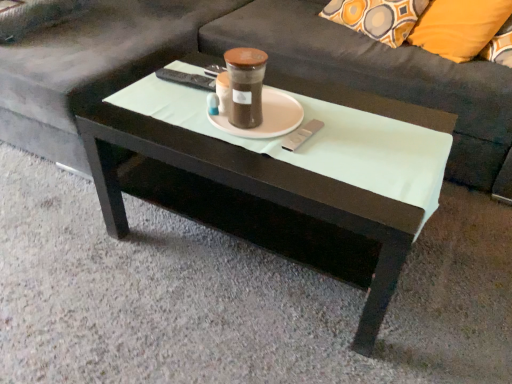
What do you see at coordinates (266, 117) in the screenshot? I see `white matte saucer at center` at bounding box center [266, 117].

Where is `brown matte glass jar at center`? brown matte glass jar at center is located at coordinates (245, 86).

The width and height of the screenshot is (512, 384). Describe the element at coordinates (242, 45) in the screenshot. I see `dark gray fabric couch at center` at that location.

Identify the location of white matte saucer at center. Image resolution: width=512 pixels, height=384 pixels. pyautogui.click(x=266, y=117).

From a real-world perspective, between white glossy coffee table at center and dark gray fabric couch at center, who is vertically lower?

From a 3D spatial view, white glossy coffee table at center is below.

Is point (150, 121) in front of point (453, 89)?

That is True.

Consider the image. Which is more to the right, white glossy coffee table at center or dark gray fabric couch at center?

white glossy coffee table at center.

Are white glossy coffee table at center and brown matte glass jar at center located far from each other?

No, white glossy coffee table at center is not far away from brown matte glass jar at center.

Would you say white glossy coffee table at center is to the left or to the right of brown matte glass jar at center in the picture?

In the image, white glossy coffee table at center appears on the right side of brown matte glass jar at center.

Could you tell me if white glossy coffee table at center is turned towards brown matte glass jar at center?

No, white glossy coffee table at center is not aimed at brown matte glass jar at center.

Is white glossy coffee table at center taller or shorter than brown matte glass jar at center?

Clearly, white glossy coffee table at center is taller compared to brown matte glass jar at center.

Does orange fabric pillow at upper right have a lesser height compared to white glossy coffee table at center?

Yes, orange fabric pillow at upper right is shorter than white glossy coffee table at center.

Considering the relative sizes of orange fabric pillow at upper right and white glossy coffee table at center in the image provided, is orange fabric pillow at upper right bigger than white glossy coffee table at center?

Actually, orange fabric pillow at upper right might be smaller than white glossy coffee table at center.

From a real-world perspective, is orange fabric pillow at upper right beneath white glossy coffee table at center?

No.

Which is closer, [476,15] or [100,158]?

Clearly, point [476,15] is more distant from the camera than point [100,158].

Looking at this image, is orange fabric pillow at upper right not near white matte saucer at center?

They are positioned close to each other.

Does orange fabric pillow at upper right have a smaller size compared to white matte saucer at center?

No.

Is point (416, 38) more distant than point (298, 121)?

Yes.

Image resolution: width=512 pixels, height=384 pixels. What are the coordinates of `saucer that appears above the orange fabric pillow at upper right (from a real-world perspective)` in the screenshot? It's located at (266, 117).

Do you think white matte saucer at center is within dark gray fabric couch at center, or outside of it?

white matte saucer at center lies outside dark gray fabric couch at center.

Who is bigger, white matte saucer at center or dark gray fabric couch at center?

dark gray fabric couch at center is bigger.

The width and height of the screenshot is (512, 384). I want to click on studio couch behind the white matte saucer at center, so click(242, 45).

Considering the relative positions of white matte saucer at center and dark gray fabric couch at center in the image provided, is white matte saucer at center in front of dark gray fabric couch at center?

Yes, it is in front of dark gray fabric couch at center.

Is dark gray fabric couch at center in contact with orange fabric pillow at upper right?

They are not placed beside each other.

Which is behind, dark gray fabric couch at center or orange fabric pillow at upper right?

orange fabric pillow at upper right.

Which of these two, dark gray fabric couch at center or orange fabric pillow at upper right, is wider?

dark gray fabric couch at center.

Find the location of a particular element. studio couch above the orange fabric pillow at upper right (from the image's perspective) is located at coordinates (242, 45).

Does dark gray fabric couch at center contain white matte saucer at center?

No, white matte saucer at center is located outside of dark gray fabric couch at center.

Is white matte saucer at center at the back of dark gray fabric couch at center?

No, dark gray fabric couch at center is not facing away from white matte saucer at center.

Measure the distance between dark gray fabric couch at center and white matte saucer at center.

dark gray fabric couch at center and white matte saucer at center are 28.31 inches apart.

Which of these two, dark gray fabric couch at center or white matte saucer at center, is thinner?

With smaller width is white matte saucer at center.

Identify the location of studio couch located on the left of white glossy coffee table at center. (242, 45).

At what (x,y) coordinates should I click in order to perform the action: click on beverage above the white glossy coffee table at center (from the image's perspective). Please return your answer as a coordinate pair (x, y). This screenshot has height=384, width=512. Looking at the image, I should click on (245, 86).

From the image, which object appears to be nearer to dark gray fabric couch at center, white glossy coffee table at center or brown matte glass jar at center?

white glossy coffee table at center is positioned closer to the anchor dark gray fabric couch at center.

Based on their spatial positions, is brown matte glass jar at center or white glossy coffee table at center further from white matte saucer at center?

Among the two, white glossy coffee table at center is located further to white matte saucer at center.

Based on their spatial positions, is brown matte glass jar at center or white glossy coffee table at center further from orange fabric pillow at upper right?

white glossy coffee table at center.

Estimate the real-world distances between objects in this image. Which object is closer to white glossy coffee table at center, orange fabric pillow at upper right or dark gray fabric couch at center?

dark gray fabric couch at center is closer to white glossy coffee table at center.

Looking at the image, which one is located closer to orange fabric pillow at upper right, white matte saucer at center or brown matte glass jar at center?

white matte saucer at center.

When comparing their distances from orange fabric pillow at upper right, does brown matte glass jar at center or dark gray fabric couch at center seem closer?

dark gray fabric couch at center is positioned closer to the anchor orange fabric pillow at upper right.

Looking at the image, which one is located further to orange fabric pillow at upper right, white glossy coffee table at center or brown matte glass jar at center?

white glossy coffee table at center lies further to orange fabric pillow at upper right than the other object.

From the image, which object appears to be farther from orange fabric pillow at upper right, dark gray fabric couch at center or white glossy coffee table at center?

Based on the image, white glossy coffee table at center appears to be further to orange fabric pillow at upper right.

Locate an element on the screen. beverage between dark gray fabric couch at center and orange fabric pillow at upper right in the horizontal direction is located at coordinates (245, 86).

Identify the location of saucer between brown matte glass jar at center and white glossy coffee table at center from top to bottom. This screenshot has width=512, height=384. (266, 117).

The height and width of the screenshot is (384, 512). Find the location of `saucer between dark gray fabric couch at center and orange fabric pillow at upper right in the horizontal direction`. saucer between dark gray fabric couch at center and orange fabric pillow at upper right in the horizontal direction is located at coordinates (266, 117).

Locate an element on the screen. coffee table between brown matte glass jar at center and orange fabric pillow at upper right in the horizontal direction is located at coordinates (252, 202).